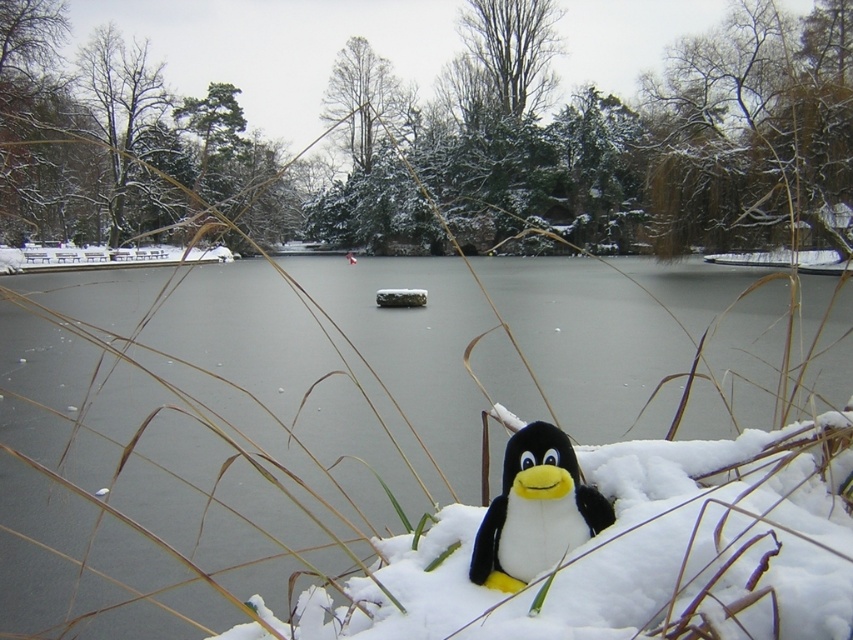
Is white fluffy snow at center in front of frozen water at center?

Yes, it is.

Can you confirm if white fluffy snow at center is bigger than frozen water at center?

No.

Is point (730, 477) positioned behind point (512, 289)?

No, it is not.

This screenshot has height=640, width=853. In order to click on white fluffy snow at center in this screenshot , I will do `click(618, 547)`.

Can you confirm if white fluffy snow at center is smaller than black plush penguin at lower center?

Actually, white fluffy snow at center might be larger than black plush penguin at lower center.

Which is behind, point (291, 628) or point (508, 579)?

The point (291, 628) is behind.

I want to click on white fluffy snow at center, so click(618, 547).

Is black plush penguin at lower center to the right of frozen water at center from the viewer's perspective?

Indeed, black plush penguin at lower center is positioned on the right side of frozen water at center.

Which is behind, point (479, 528) or point (524, 275)?

The point (524, 275) is behind.

Who is more distant from viewer, (589, 509) or (492, 273)?

Point (492, 273)

Find the location of `black plush penguin at lower center`. black plush penguin at lower center is located at coordinates (535, 509).